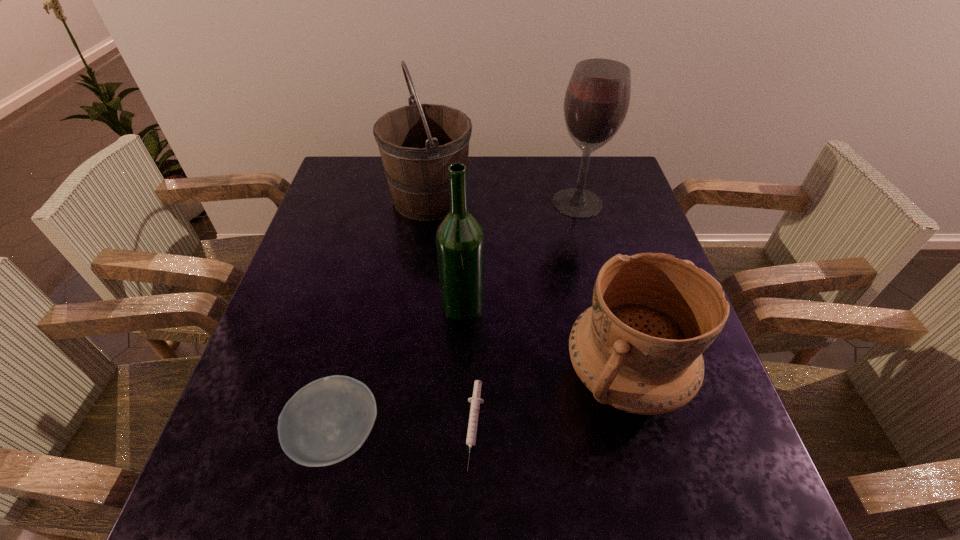
Where is `vacant region between the pottery and the syringe`? The image size is (960, 540). vacant region between the pottery and the syringe is located at coordinates (550, 401).

Image resolution: width=960 pixels, height=540 pixels. I want to click on free space that is in between the left alcohol and the right alcohol, so click(520, 254).

Find the location of `vacant area that lies between the third farthest object and the bowl`. vacant area that lies between the third farthest object and the bowl is located at coordinates (399, 370).

What are the coordinates of `free spot between the shortest object and the third farthest object` in the screenshot? It's located at (469, 365).

Find the location of `vacant space that is in between the bucket and the farther alcohol`. vacant space that is in between the bucket and the farther alcohol is located at coordinates (504, 200).

Find the location of a particular element. Image resolution: width=960 pixels, height=540 pixels. free space between the farther alcohol and the bucket is located at coordinates (504, 200).

Identify the location of object that is the third closest to the farther alcohol. Image resolution: width=960 pixels, height=540 pixels. (638, 348).

Find the location of `object identified as the closest to the nearer alcohol`. object identified as the closest to the nearer alcohol is located at coordinates [x=638, y=348].

Find the location of `blank space that satisfies the following two spatial constraints: 1. on the front side of the third shortest object; 2. on the right side of the bucket`. blank space that satisfies the following two spatial constraints: 1. on the front side of the third shortest object; 2. on the right side of the bucket is located at coordinates (406, 375).

Locate an element on the screen. The height and width of the screenshot is (540, 960). free space in the image that satisfies the following two spatial constraints: 1. on the front side of the bucket; 2. on the left side of the nearer alcohol is located at coordinates (416, 304).